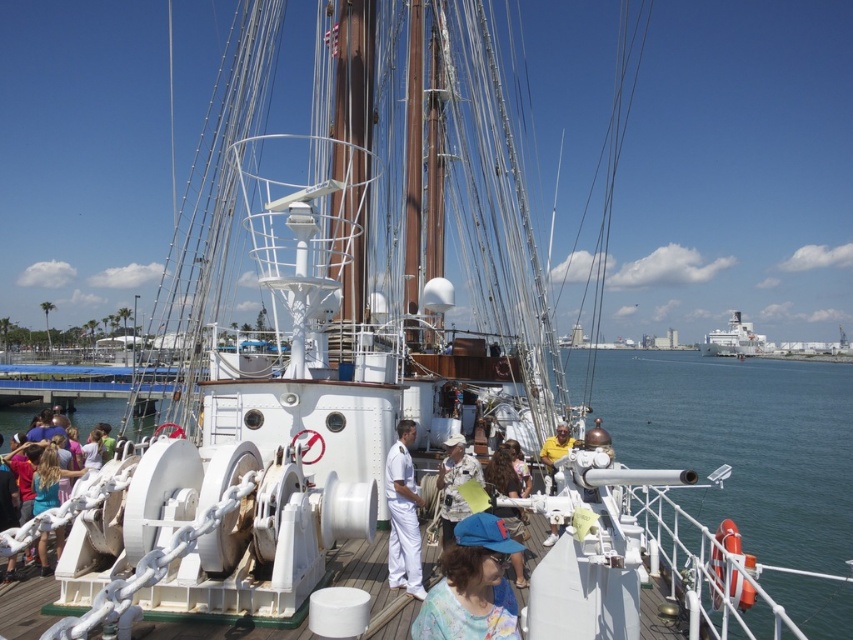
You are a photographer standing on the deck of the ship. You want to capture a photo that includes both the white matte water at center and the yellow fabric shirt at center. Which object should you focus on first if you want to ensure both are in frame?

Result: The white matte water at center is larger in size than the yellow fabric shirt at center, so you should focus on the white matte water at center first to ensure both are in frame.

Looking at this image, you are standing on the deck of the ship and notice a blue fabric cap at center. If you were to walk directly towards the cap from your current position, which direction should you head? Please provide your answer in terms of compass directions like north, south, east, or west.

The blue fabric cap at center is located at coordinates point (471,586). Since the ship is oriented with its bow facing forward, the cap is positioned towards the east side of the deck.

You are standing on the deck of the ship and notice the white matte water at center and the yellow fabric shirt at center. Which object is closer to you?

The yellow fabric shirt at center is closer to you because it is above the white matte water at center, which is positioned under it.